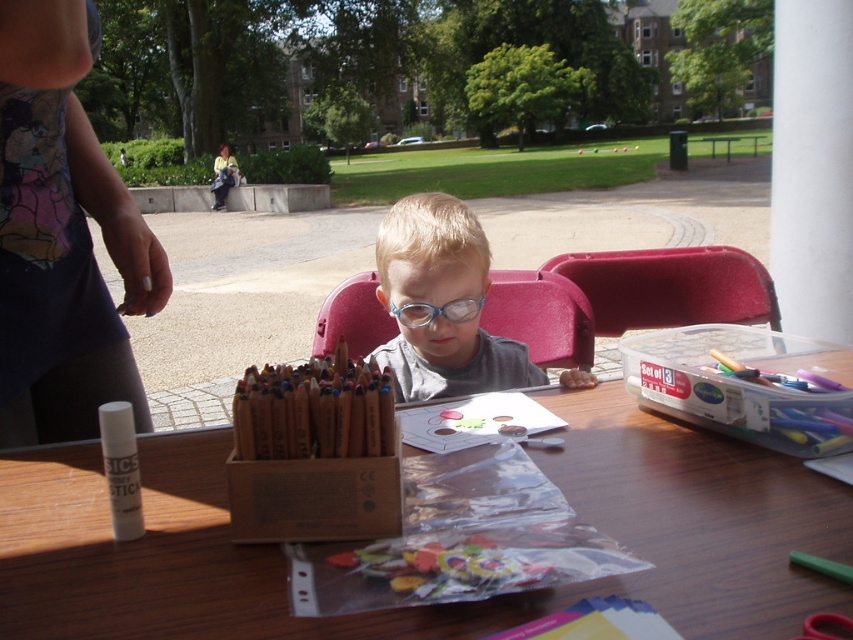
You are a photographer setting up for a closeup shot of the white matte glue stick at lower left. The camera is positioned at a standard height. Can you determine if the glue stick is within the camera frame based on its distance?

The white matte glue stick at lower left is 27.18 inches away from the camera. Since standard camera lenses have a minimum focusing distance of about 12 inches, the glue stick is within the frame and can be captured clearly.

You are a parent trying to organize the art supplies on the table. The matte plastic child at center is currently in the way of the metallic silver scissors at lower right. Can you move the child to the left side of the scissors without moving the scissors?

The matte plastic child at center is located above the metallic silver scissors at lower right. To move the child to the left side of the scissors, you would need to shift it from the upper position to the left of the scissors, which is possible as long as there is space on the left side of the scissors.